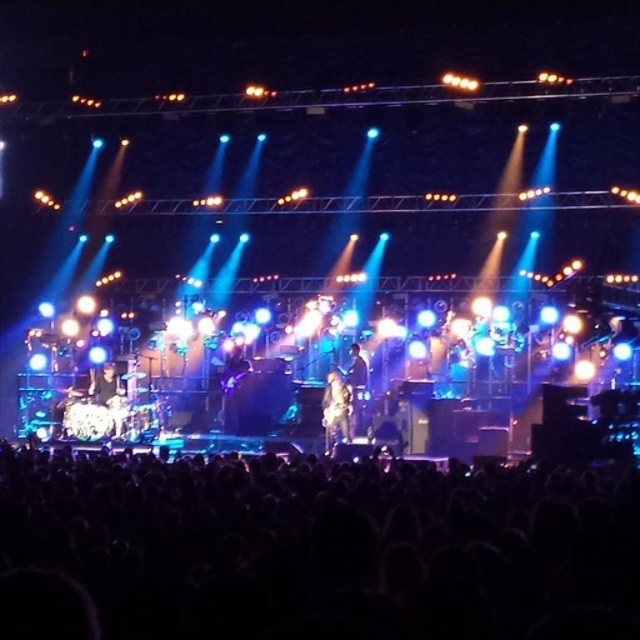
You are a photographer at the concert and want to capture a closeup shot of the metallic guitar at center without the shiny black drum set at left appearing in the frame. Is this possible given their sizes?

The metallic guitar at center is smaller than the shiny black drum set at left, so it might be challenging to frame the guitar without including the drum set in the shot due to the drum set being larger and potentially obstructing the view.

You are standing at the center of the stage and want to move to the point marked by the coordinates point (330, 545). Which direction should you move to reach it?

The point (330, 545) is on the black matte crowd at lower center, so you should move downward from the center of the stage to reach it.